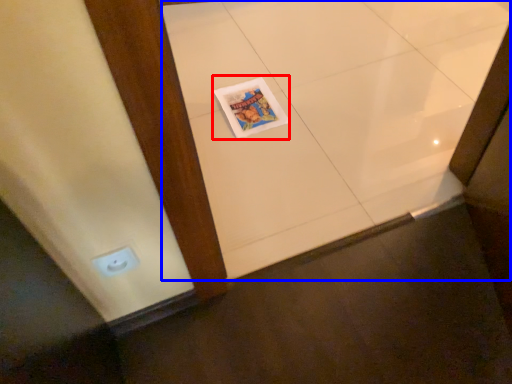
Question: Which of the following is the closest to the observer, magazine (highlighted by a red box) or ceramic tile (highlighted by a blue box)?

Choices:
 (A) magazine
 (B) ceramic tile

Answer: (B)